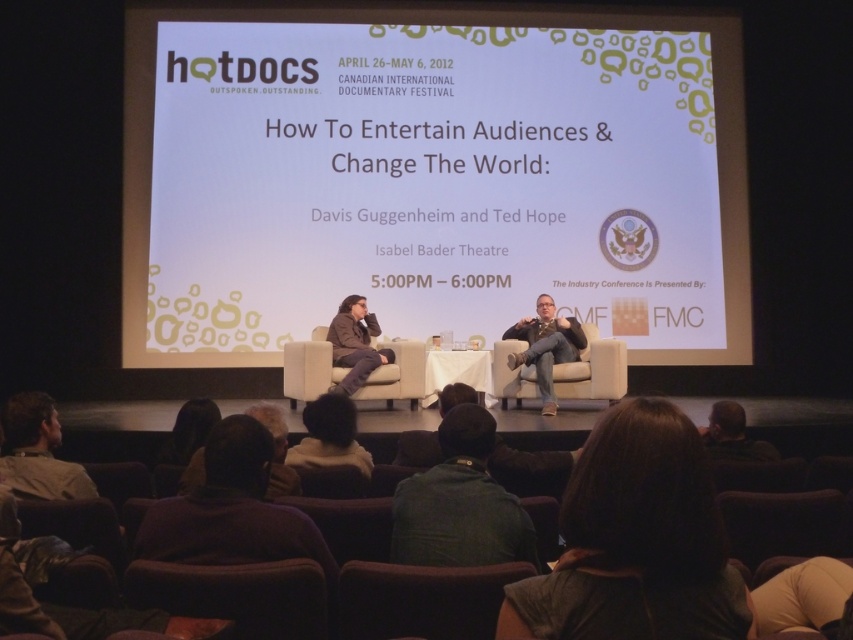
You are organizing a panel discussion at the Isabel Bader Theatre and need to seat two speakers. The white fabric couch at center and beige fabric chair at center are available. Which seating option provides more seating space for the speakers?

The white fabric couch at center provides more seating space because it is larger in size than the beige fabric chair at center.

You are attending the panel discussion at Hot Docs Canadian International Documentary Festival. You want to take a photo of the stage from your current position. The camera you have can focus on objects up to 2.5 meters away. Will the point at coordinates point (347, 616) be within the camera focus range?

The distance between point (347, 616) and the viewer is 2.33 meters, which is within the camera focus range of up to 2.5 meters. Therefore, the point (347, 616) will be within the camera focus range.

You are a photographer at the Hot Docs festival event. You need to capture a photo of the two speakers, the light brown leather jacket at lower left and the dark brown hair at lower right. The camera you are using has a limited depth of field. Which object should you focus on to ensure both are in focus?

To ensure both the light brown leather jacket at lower left and the dark brown hair at lower right are in focus, focus on the light brown leather jacket at lower left since it is thinner and closer to the camera, allowing the depth of field to cover both objects.